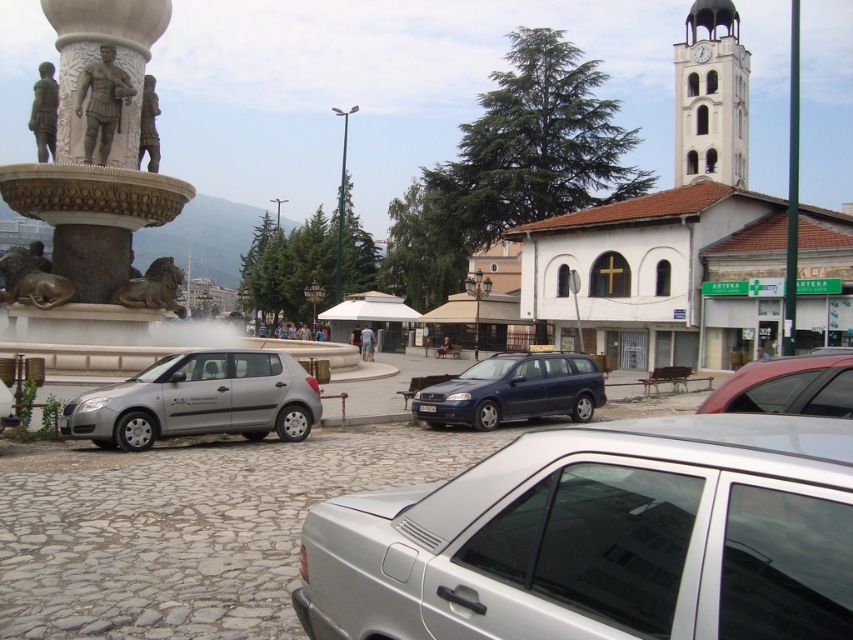
Is metallic red car at right further to camera compared to golden polished stone lion at left?

No, it is not.

Who is lower down, metallic red car at right or golden polished stone lion at left?

metallic red car at right is below.

Between point (813, 362) and point (141, 305), which one is positioned behind?

The point (141, 305) is behind.

In order to click on metallic red car at right in this screenshot , I will do `click(787, 387)`.

Is bronze statue at left smaller than white marble statue at upper left?

No.

Who is more distant from viewer, (45, 77) or (142, 88)?

Positioned behind is point (142, 88).

Measure the distance between bronze statue at left and camera.

bronze statue at left and camera are 87.91 feet apart from each other.

I want to click on bronze statue at left, so click(44, 112).

Is dark blue metallic station wagon at center bigger than golden polished stone lion at left?

No, dark blue metallic station wagon at center is not bigger than golden polished stone lion at left.

Who is more forward, (454, 410) or (158, 284)?

Point (454, 410) is in front.

What are the coordinates of `dark blue metallic station wagon at center` in the screenshot? It's located at (514, 390).

This screenshot has height=640, width=853. Identify the location of dark blue metallic station wagon at center. (514, 390).